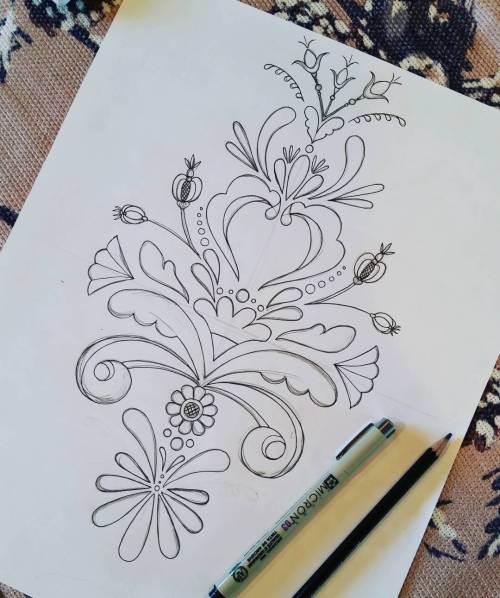
Find the location of `marker`. marker is located at coordinates (299, 518).